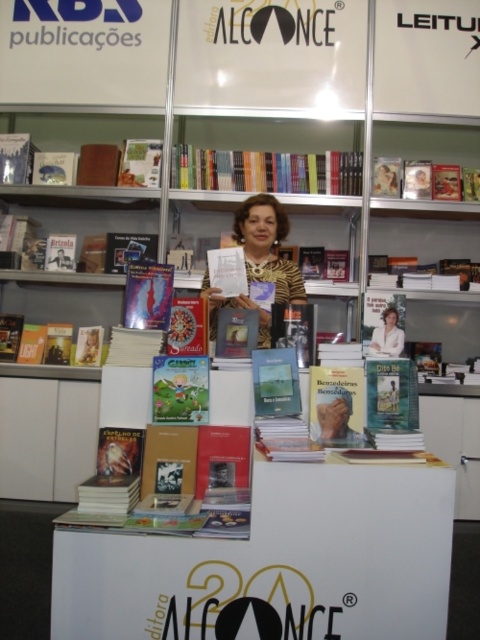
Between hardcover books at upper center and leopard print blouse at center, which one has more height?

leopard print blouse at center is taller.

Which is more to the right, hardcover books at upper center or leopard print blouse at center?

From the viewer's perspective, hardcover books at upper center appears more on the right side.

I want to click on hardcover books at upper center, so click(x=265, y=170).

From the picture: Which is below, hardcover books at upper center or matte white blouse at center?

matte white blouse at center is below.

Is hardcover books at upper center positioned before matte white blouse at center?

No, hardcover books at upper center is further to the viewer.

This screenshot has width=480, height=640. Identify the location of hardcover books at upper center. (265, 170).

Can you confirm if leopard print blouse at center is wider than hardcover book at center?

Yes, leopard print blouse at center is wider than hardcover book at center.

Is leopard print blouse at center positioned before hardcover book at center?

No, it is behind hardcover book at center.

Does point (285, 273) lie behind point (381, 394)?

Yes, point (285, 273) is behind point (381, 394).

The height and width of the screenshot is (640, 480). Identify the location of leopard print blouse at center. (266, 246).